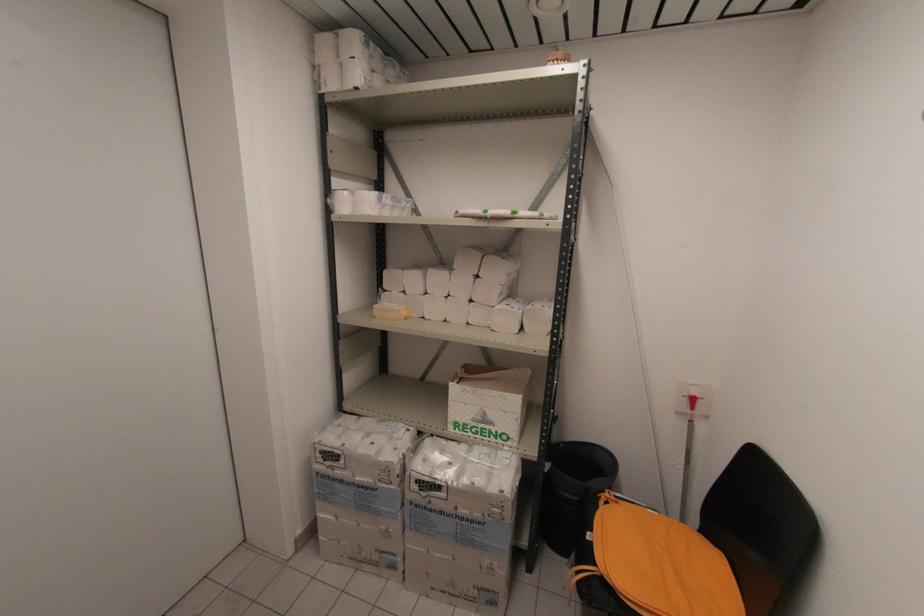
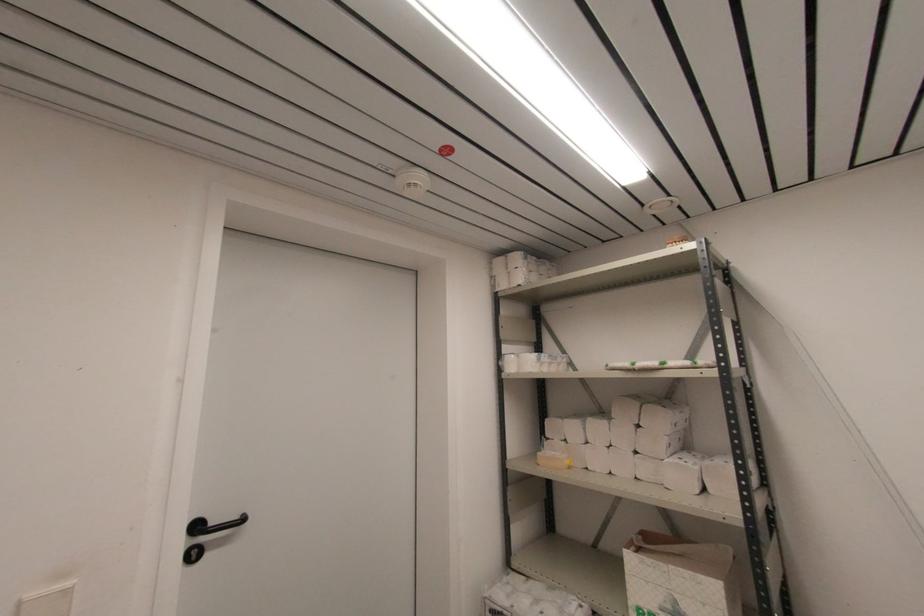
Where in the second image is the point corresponding to the point at 407,272 from the first image?

(566, 421)